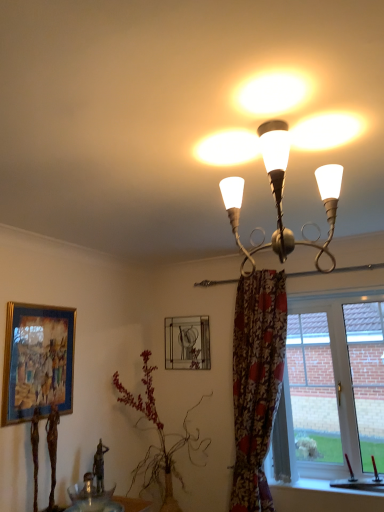
Question: From a real-world perspective, relative to transparent glass bowl at lower left, is floral fabric curtain at right vertically above or below?

Choices:
 (A) above
 (B) below

Answer: (A)

Question: Based on their sizes in the image, would you say floral fabric curtain at right is bigger or smaller than transparent glass bowl at lower left?

Choices:
 (A) big
 (B) small

Answer: (A)

Question: Considering the real-world distances, which object is farthest from the translucent glass bowl at lower center?

Choices:
 (A) green leafy plant at center
 (B) gold-framed painting at left, which is counted as the 2th picture frame, starting from the right
 (C) metallic silver picture frame at upper center, positioned as the 2th picture frame in left-to-right order
 (D) transparent glass bowl at lower left
 (E) metallic chandelier at upper center

Answer: (E)

Question: Which object is the closest to the transparent glass bowl at lower left?

Choices:
 (A) gold-framed painting at left, the 1th picture frame viewed from the left
 (B) green leafy plant at center
 (C) floral fabric curtain at right
 (D) metallic chandelier at upper center
 (E) metallic silver picture frame at upper center, the first picture frame from the right

Answer: (B)